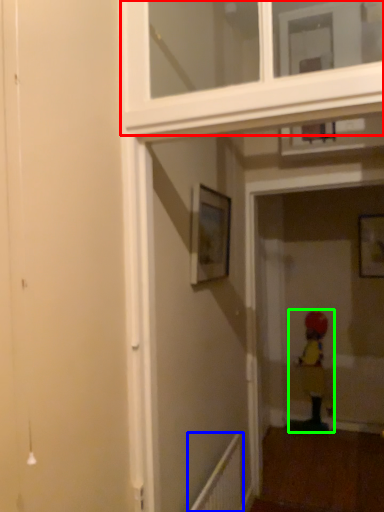
Question: Estimate the real-world distances between objects in this image. Which object is farther from window frame (highlighted by a red box), radiator (highlighted by a blue box) or child (highlighted by a green box)?

Choices:
 (A) radiator
 (B) child

Answer: (B)